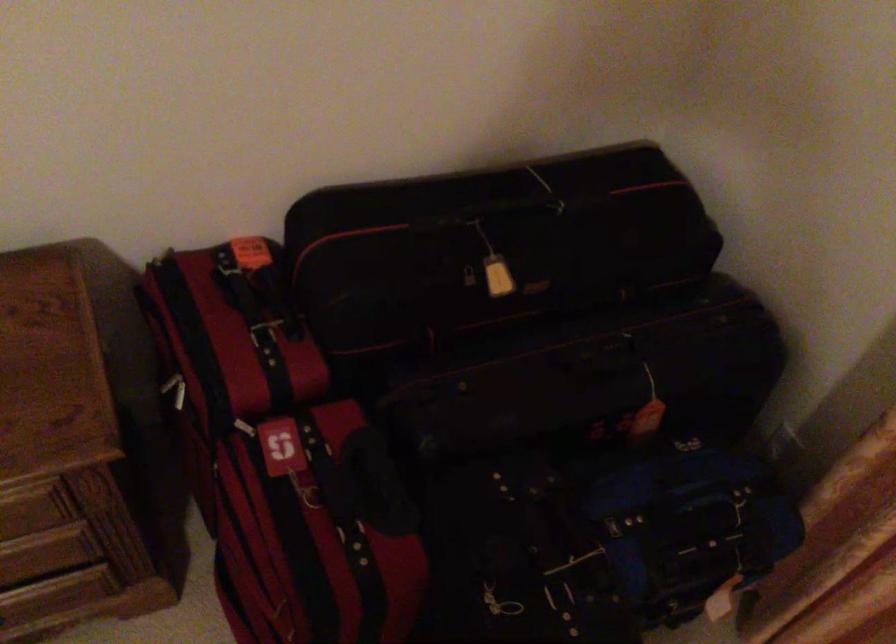
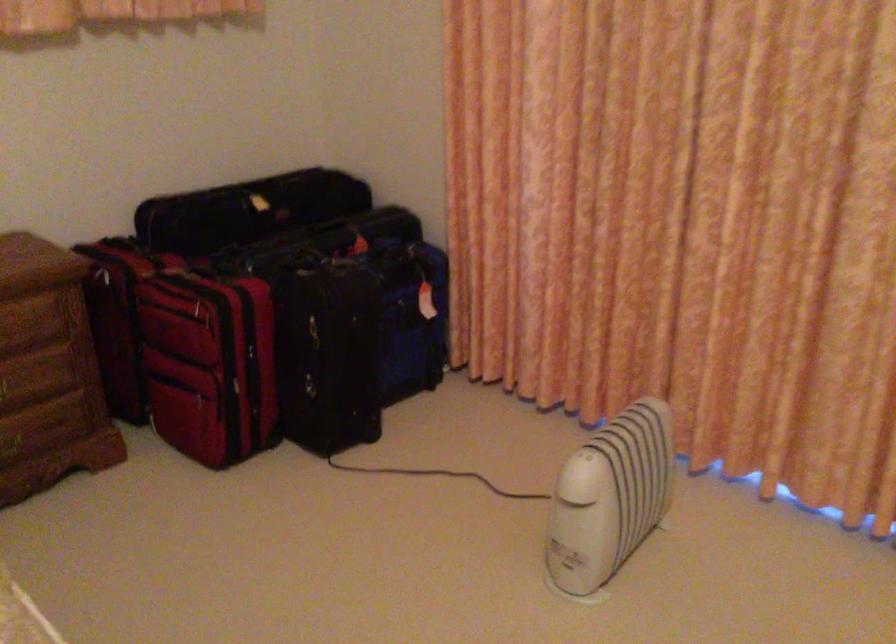
In the second image, find the point that corresponds to (554,564) in the first image.

(330, 266)